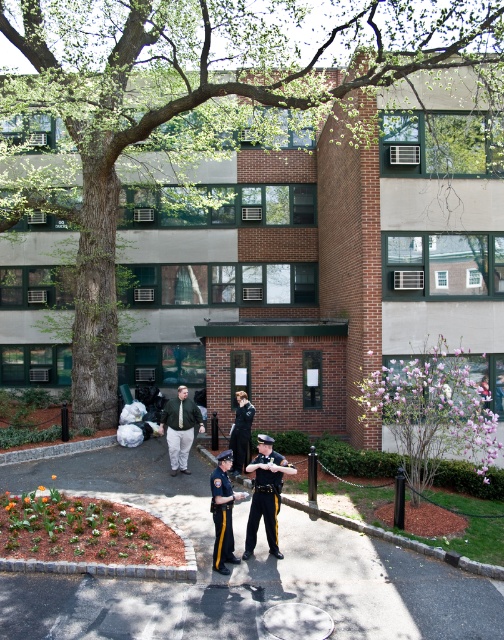
Is smooth asphalt pavement at center bigger than shiny black uniform at center?

Incorrect, smooth asphalt pavement at center is not larger than shiny black uniform at center.

Which is below, smooth asphalt pavement at center or shiny black uniform at center?

Answer: smooth asphalt pavement at center is lower down.

Identify the location of smooth asphalt pavement at center. (236, 570).

Consider the image. Is black matte uniform at center thinner than dark blue uniform at center?

No.

Find the location of a particular element. black matte uniform at center is located at coordinates (266, 493).

Describe the element at coordinates (266, 493) in the screenshot. This screenshot has height=640, width=504. I see `black matte uniform at center` at that location.

Find the location of a particular element. This screenshot has height=640, width=504. black matte uniform at center is located at coordinates (266, 493).

Locate an element on the screen. The height and width of the screenshot is (640, 504). green matte jacket at center is located at coordinates (179, 428).

Can you confirm if green matte jacket at center is taller than dark blue uniform at center?

Yes.

Where is `green matte jacket at center`? The image size is (504, 640). green matte jacket at center is located at coordinates (179, 428).

Where is `green matte jacket at center`? green matte jacket at center is located at coordinates (179, 428).